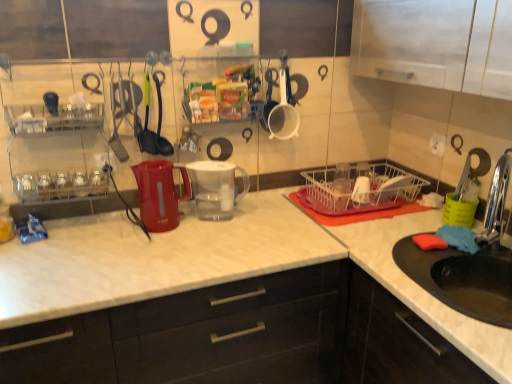
The width and height of the screenshot is (512, 384). I want to click on vacant space in front of white wire basket at center, so click(368, 233).